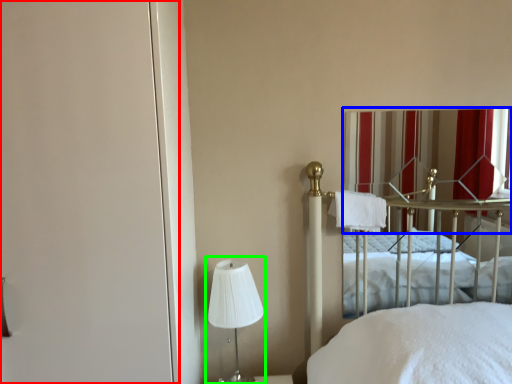
Question: Estimate the real-world distances between objects in this image. Which object is closer to screen door (highlighted by a red box), curtain (highlighted by a blue box) or bedside lamp (highlighted by a green box)?

Choices:
 (A) curtain
 (B) bedside lamp

Answer: (B)